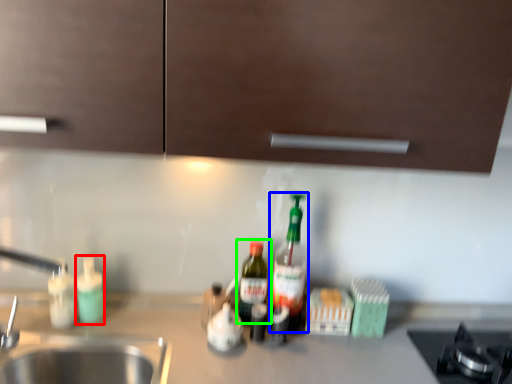
Question: Estimate the real-world distances between objects in this image. Which object is closer to bottle (highlighted by a red box), bottle (highlighted by a blue box) or bottle (highlighted by a green box)?

Choices:
 (A) bottle
 (B) bottle

Answer: (B)